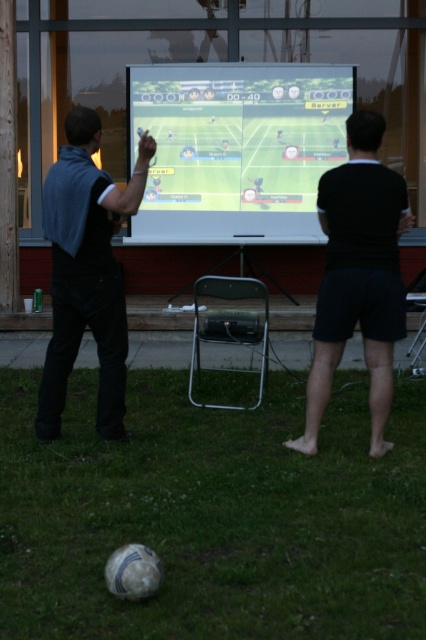
You are standing at the point with coordinates point (305, 390) and want to walk to the point with coordinates point (317, 234). Is the destination point behind you or in front of you?

The destination point (317, 234) is behind the starting point (305, 390), so it is behind you.

You are a photographer trying to capture the soccer ball and the two people in the scene. Which object, the black matte shorts at center or the dark blue fabric at left, is located lower in the image?

The black matte shorts at center is positioned under the dark blue fabric at left, so it is located lower in the image.

You are setting up a projector for a movie night in the grassy area. The projector is placed at the same level as the black matte shorts at center. Where should you aim the projector to display the movie on the white glossy projection screen at center?

You should aim the projector upwards since the white glossy projection screen at center is located above the black matte shorts at center.